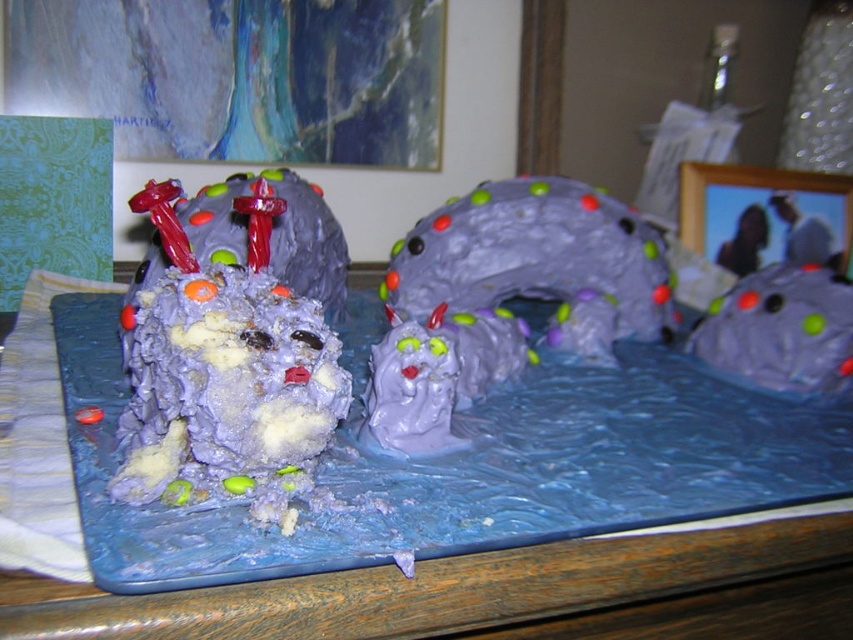
Is point (65, 637) closer to camera compared to point (242, 408)?

Yes, it is.

Does blue fondant cake at center appear on the left side of purple frosted cake at left?

Yes, blue fondant cake at center is to the left of purple frosted cake at left.

Where is `blue fondant cake at center`? The height and width of the screenshot is (640, 853). blue fondant cake at center is located at coordinates (419, 563).